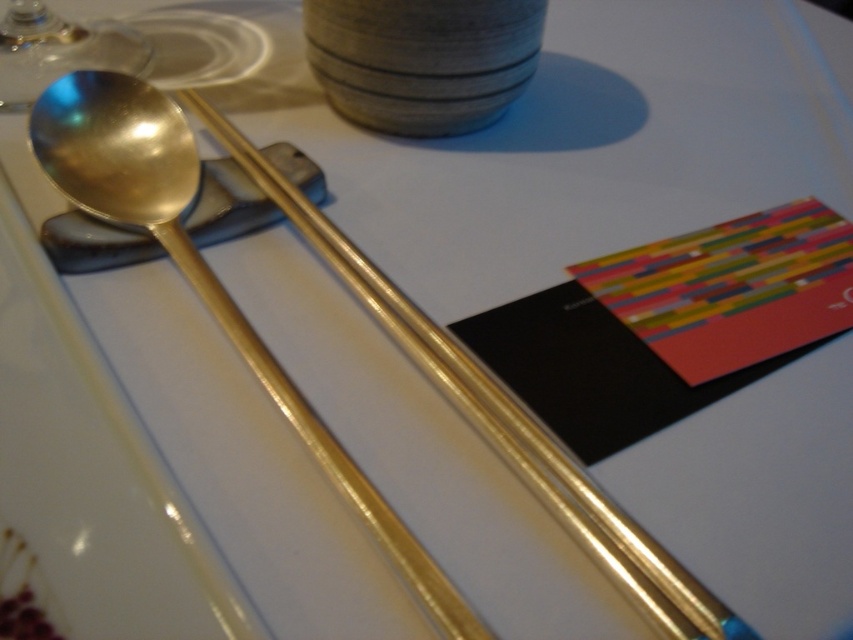
Which of these two, gold shiny spoon at upper left or transparent glass at upper left, stands taller?

With more height is gold shiny spoon at upper left.

Which is below, gold shiny spoon at upper left or transparent glass at upper left?

gold shiny spoon at upper left

Is point (410, 576) positioned before point (18, 83)?

Yes, it is.

I want to click on gold shiny spoon at upper left, so click(204, 273).